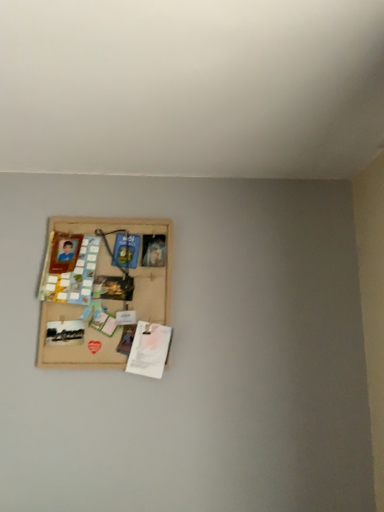
Image resolution: width=384 pixels, height=512 pixels. Describe the element at coordinates (103, 291) in the screenshot. I see `wooden board at upper left` at that location.

Find the location of `wooden board at upper left`. wooden board at upper left is located at coordinates (103, 291).

Where is `wooden board at upper left`? wooden board at upper left is located at coordinates (103, 291).